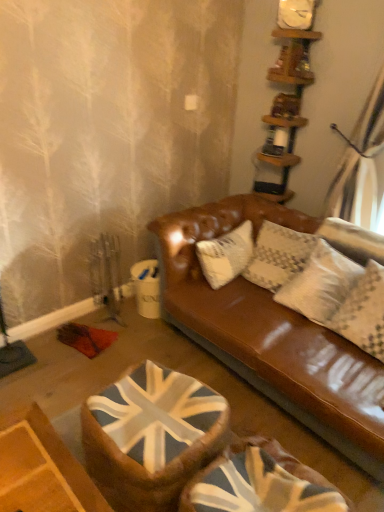
How much space does union jack fabric swivel chair at lower center, which is counted as the 1th swivel chair, starting from the right, occupy horizontally?

union jack fabric swivel chair at lower center, which is counted as the 1th swivel chair, starting from the right, is 52.59 centimeters in width.

The height and width of the screenshot is (512, 384). I want to click on union jack fabric swivel chair at lower center, which is counted as the 1th swivel chair, starting from the right, so click(259, 483).

Between point (141, 460) and point (367, 261), which one is positioned in front?

The point (141, 460) is closer to the camera.

Who is shorter, union jack fabric swivel chair at center, which ranks as the first swivel chair in left-to-right order, or white textured pillow at upper right?

Standing shorter between the two is white textured pillow at upper right.

Is union jack fabric swivel chair at center, positioned as the second swivel chair in right-to-left order, oriented away from white textured pillow at upper right?

Absolutely, union jack fabric swivel chair at center, positioned as the second swivel chair in right-to-left order, is directed away from white textured pillow at upper right.

Which object is thinner, union jack fabric swivel chair at center, which ranks as the first swivel chair in left-to-right order, or white textured pillow at upper right?

white textured pillow at upper right.

Between white matte clock at upper center and wooden shelves at upper right, which one has smaller size?

white matte clock at upper center.

Is white matte clock at upper center taller than wooden shelves at upper right?

No, white matte clock at upper center is not taller than wooden shelves at upper right.

Relative to wooden shelves at upper right, is white matte clock at upper center in front or behind?

In the image, white matte clock at upper center appears behind wooden shelves at upper right.

Does point (295, 7) lie behind point (277, 139)?

No.

From the image's perspective, between wooden shelves at upper right and union jack fabric swivel chair at center, positioned as the second swivel chair in right-to-left order, who is located below?

union jack fabric swivel chair at center, positioned as the second swivel chair in right-to-left order, from the image's perspective.

This screenshot has height=512, width=384. Identify the location of shelf above the union jack fabric swivel chair at center, which ranks as the first swivel chair in left-to-right order (from a real-world perspective). (284, 114).

Consider the image. Relative to union jack fabric swivel chair at center, positioned as the second swivel chair in right-to-left order, is wooden shelves at upper right in front or behind?

In the image, wooden shelves at upper right appears behind union jack fabric swivel chair at center, positioned as the second swivel chair in right-to-left order.

Is white matte clock at upper center wider than white textured pillow at upper right?

No, white matte clock at upper center is not wider than white textured pillow at upper right.

In the image, is white matte clock at upper center on the left side or the right side of white textured pillow at upper right?

In the image, white matte clock at upper center appears on the left side of white textured pillow at upper right.

Is white matte clock at upper center far from white textured pillow at upper right?

Yes, white matte clock at upper center and white textured pillow at upper right are located far from each other.

Between white matte clock at upper center and white textured pillow at upper right, which one has smaller size?

With smaller size is white matte clock at upper center.

Who is shorter, wooden shelves at upper right or white textured pillow at upper right?

Standing shorter between the two is white textured pillow at upper right.

Measure the distance from wooden shelves at upper right to white textured pillow at upper right.

wooden shelves at upper right is 29.68 inches from white textured pillow at upper right.

Considering the positions of objects wooden shelves at upper right and white textured pillow at upper right in the image provided, who is behind, wooden shelves at upper right or white textured pillow at upper right?

wooden shelves at upper right is more distant.

Is wooden shelves at upper right positioned with its back to white textured pillow at upper right?

No, white textured pillow at upper right is not at the back of wooden shelves at upper right.

Which is behind, point (335, 246) or point (255, 494)?

Positioned behind is point (335, 246).

How different are the orientations of white textured pillow at upper right and union jack fabric swivel chair at lower center, which is the 2th swivel chair from left to right, in degrees?

They differ by 3.24 degrees in their facing directions.

How distant is white textured pillow at upper right from union jack fabric swivel chair at lower center, which is counted as the 1th swivel chair, starting from the right?

white textured pillow at upper right is 3.80 feet from union jack fabric swivel chair at lower center, which is counted as the 1th swivel chair, starting from the right.

Can you confirm if white textured pillow at upper right is smaller than union jack fabric swivel chair at lower center, which is counted as the 1th swivel chair, starting from the right?

Correct, white textured pillow at upper right occupies less space than union jack fabric swivel chair at lower center, which is counted as the 1th swivel chair, starting from the right.

From a real-world perspective, is union jack fabric swivel chair at center, which ranks as the first swivel chair in left-to-right order, over union jack fabric swivel chair at lower center, which is the 2th swivel chair from left to right?

No, from a real-world perspective, union jack fabric swivel chair at center, which ranks as the first swivel chair in left-to-right order, is not over union jack fabric swivel chair at lower center, which is the 2th swivel chair from left to right

Does union jack fabric swivel chair at center, which ranks as the first swivel chair in left-to-right order, turn towards union jack fabric swivel chair at lower center, which is the 2th swivel chair from left to right?

No, union jack fabric swivel chair at center, which ranks as the first swivel chair in left-to-right order, is not facing towards union jack fabric swivel chair at lower center, which is the 2th swivel chair from left to right.

Is union jack fabric swivel chair at center, which ranks as the first swivel chair in left-to-right order, outside of union jack fabric swivel chair at lower center, which is counted as the 1th swivel chair, starting from the right?

Yes.

Considering the relative sizes of union jack fabric swivel chair at center, which ranks as the first swivel chair in left-to-right order, and union jack fabric swivel chair at lower center, which is counted as the 1th swivel chair, starting from the right, in the image provided, is union jack fabric swivel chair at center, which ranks as the first swivel chair in left-to-right order, smaller than union jack fabric swivel chair at lower center, which is counted as the 1th swivel chair, starting from the right,?

Yes.

From a real-world perspective, count 2nd swivel chairs downward from the white textured pillow at upper right and point to it. Please provide its 2D coordinates.

[(152, 437)]

Find the location of a particular element. This screenshot has width=384, height=512. clock above the wooden shelves at upper right (from a real-world perspective) is located at coordinates (296, 14).

Estimate the real-world distances between objects in this image. Which object is further from union jack fabric swivel chair at lower center, which is the 2th swivel chair from left to right, union jack fabric swivel chair at center, positioned as the second swivel chair in right-to-left order, or wooden shelves at upper right?

wooden shelves at upper right is positioned further to the anchor union jack fabric swivel chair at lower center, which is the 2th swivel chair from left to right.

Based on their spatial positions, is union jack fabric swivel chair at lower center, which is the 2th swivel chair from left to right, or union jack fabric swivel chair at center, positioned as the second swivel chair in right-to-left order, closer to white textured pillow at upper right?

union jack fabric swivel chair at lower center, which is the 2th swivel chair from left to right, lies closer to white textured pillow at upper right than the other object.

Looking at the image, which one is located closer to union jack fabric swivel chair at lower center, which is the 2th swivel chair from left to right, white matte clock at upper center or white textured pillow at upper right?

white textured pillow at upper right lies closer to union jack fabric swivel chair at lower center, which is the 2th swivel chair from left to right, than the other object.

Which object lies further to the anchor point wooden shelves at upper right, white textured pillow at upper right or union jack fabric swivel chair at lower center, which is the 2th swivel chair from left to right?

union jack fabric swivel chair at lower center, which is the 2th swivel chair from left to right, is further to wooden shelves at upper right.

When comparing their distances from union jack fabric swivel chair at center, which ranks as the first swivel chair in left-to-right order, does white matte clock at upper center or wooden shelves at upper right seem closer?

wooden shelves at upper right is positioned closer to the anchor union jack fabric swivel chair at center, which ranks as the first swivel chair in left-to-right order.

When comparing their distances from union jack fabric swivel chair at lower center, which is counted as the 1th swivel chair, starting from the right, does white textured pillow at upper right or wooden shelves at upper right seem further?

wooden shelves at upper right.

Estimate the real-world distances between objects in this image. Which object is closer to white matte clock at upper center, union jack fabric swivel chair at center, positioned as the second swivel chair in right-to-left order, or white textured pillow at upper right?

white textured pillow at upper right is positioned closer to the anchor white matte clock at upper center.

Looking at the image, which one is located closer to white matte clock at upper center, wooden shelves at upper right or union jack fabric swivel chair at lower center, which is counted as the 1th swivel chair, starting from the right?

wooden shelves at upper right is positioned closer to the anchor white matte clock at upper center.

Image resolution: width=384 pixels, height=512 pixels. In order to click on pillow between wooden shelves at upper right and union jack fabric swivel chair at lower center, which is the 2th swivel chair from left to right, vertically in this screenshot , I will do `click(352, 240)`.

Where is `shelf that lies between white matte clock at upper center and union jack fabric swivel chair at center, which ranks as the first swivel chair in left-to-right order, from top to bottom`? shelf that lies between white matte clock at upper center and union jack fabric swivel chair at center, which ranks as the first swivel chair in left-to-right order, from top to bottom is located at coordinates (284, 114).

The height and width of the screenshot is (512, 384). Identify the location of swivel chair between wooden shelves at upper right and union jack fabric swivel chair at lower center, which is counted as the 1th swivel chair, starting from the right, vertically. (152, 437).

Where is `pillow that lies between white matte clock at upper center and union jack fabric swivel chair at lower center, which is the 2th swivel chair from left to right, from top to bottom`? This screenshot has height=512, width=384. pillow that lies between white matte clock at upper center and union jack fabric swivel chair at lower center, which is the 2th swivel chair from left to right, from top to bottom is located at coordinates (352, 240).